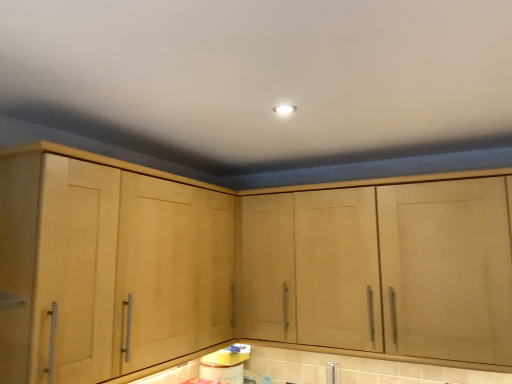
Question: Can you confirm if light wood cabinet at left, which ranks as the first cabinetry in left-to-right order, is positioned to the left of silver metallic faucet at lower center?

Choices:
 (A) no
 (B) yes

Answer: (B)

Question: Can you confirm if light wood cabinet at left, the 2th cabinetry positioned from the right, is thinner than silver metallic faucet at lower center?

Choices:
 (A) no
 (B) yes

Answer: (A)

Question: From the image's perspective, is light wood cabinet at left, which ranks as the first cabinetry in left-to-right order, located beneath silver metallic faucet at lower center?

Choices:
 (A) yes
 (B) no

Answer: (B)

Question: From a real-world perspective, is light wood cabinet at left, the 2th cabinetry positioned from the right, under silver metallic faucet at lower center?

Choices:
 (A) no
 (B) yes

Answer: (A)

Question: Is light wood cabinet at left, which ranks as the first cabinetry in left-to-right order, beside silver metallic faucet at lower center?

Choices:
 (A) no
 (B) yes

Answer: (A)

Question: Considering the positions of silver metallic faucet at lower center and light wood cabinet at center, which ranks as the first cabinetry in right-to-left order, in the image, is silver metallic faucet at lower center taller or shorter than light wood cabinet at center, which ranks as the first cabinetry in right-to-left order,?

Choices:
 (A) short
 (B) tall

Answer: (A)

Question: Looking at the image, does silver metallic faucet at lower center seem bigger or smaller compared to light wood cabinet at center, which is the 2th cabinetry in left-to-right order?

Choices:
 (A) big
 (B) small

Answer: (B)

Question: Considering their positions, is silver metallic faucet at lower center located in front of or behind light wood cabinet at center, which ranks as the first cabinetry in right-to-left order?

Choices:
 (A) front
 (B) behind

Answer: (B)

Question: Is silver metallic faucet at lower center to the left or to the right of light wood cabinet at center, which is the 2th cabinetry in left-to-right order, in the image?

Choices:
 (A) left
 (B) right

Answer: (A)

Question: Relative to light wood cabinet at center, which is the 2th cabinetry in left-to-right order, is light wood cabinet at left, the 2th cabinetry positioned from the right, in front or behind?

Choices:
 (A) front
 (B) behind

Answer: (A)

Question: From a real-world perspective, is light wood cabinet at left, the 2th cabinetry positioned from the right, physically located above or below light wood cabinet at center, which is the 2th cabinetry in left-to-right order?

Choices:
 (A) above
 (B) below

Answer: (A)

Question: Is light wood cabinet at left, the 2th cabinetry positioned from the right, inside the boundaries of light wood cabinet at center, which ranks as the first cabinetry in right-to-left order, or outside?

Choices:
 (A) outside
 (B) inside

Answer: (A)

Question: From the image's perspective, is light wood cabinet at left, the 2th cabinetry positioned from the right, located above or below light wood cabinet at center, which is the 2th cabinetry in left-to-right order?

Choices:
 (A) below
 (B) above

Answer: (B)

Question: In terms of height, does light wood cabinet at center, which ranks as the first cabinetry in right-to-left order, look taller or shorter compared to light wood cabinet at left, which ranks as the first cabinetry in left-to-right order?

Choices:
 (A) short
 (B) tall

Answer: (A)

Question: Which is correct: light wood cabinet at center, which is the 2th cabinetry in left-to-right order, is inside light wood cabinet at left, which ranks as the first cabinetry in left-to-right order, or outside of it?

Choices:
 (A) inside
 (B) outside

Answer: (B)